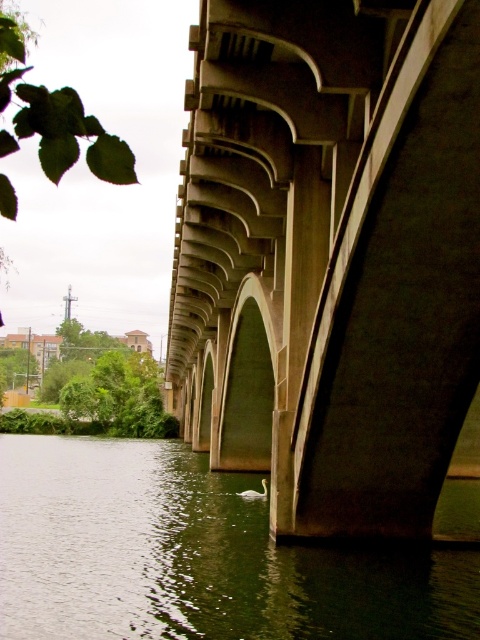
Based on the photo, which is below, green smooth water at lower center or white glossy swan at lower center?

Positioned lower is green smooth water at lower center.

Does green smooth water at lower center have a lesser width compared to white glossy swan at lower center?

No.

Locate an element on the screen. green smooth water at lower center is located at coordinates (194, 556).

Is point (264, 262) farther from viewer compared to point (245, 493)?

No, it is in front of (245, 493).

Is concrete at center to the left of white glossy swan at lower center from the viewer's perspective?

Yes, concrete at center is to the left of white glossy swan at lower center.

Is point (429, 268) more distant than point (263, 483)?

That is False.

The height and width of the screenshot is (640, 480). Identify the location of concrete at center. pyautogui.click(x=330, y=253).

Can you confirm if concrete at center is bigger than green smooth water at lower center?

Correct, concrete at center is larger in size than green smooth water at lower center.

Can you confirm if concrete at center is positioned to the left of green smooth water at lower center?

Correct, you'll find concrete at center to the left of green smooth water at lower center.

Does point (350, 436) come farther from viewer compared to point (12, 612)?

Yes, point (350, 436) is behind point (12, 612).

At what (x,y) coordinates should I click in order to perform the action: click on concrete at center. Please return your answer as a coordinate pair (x, y). The height and width of the screenshot is (640, 480). Looking at the image, I should click on (330, 253).